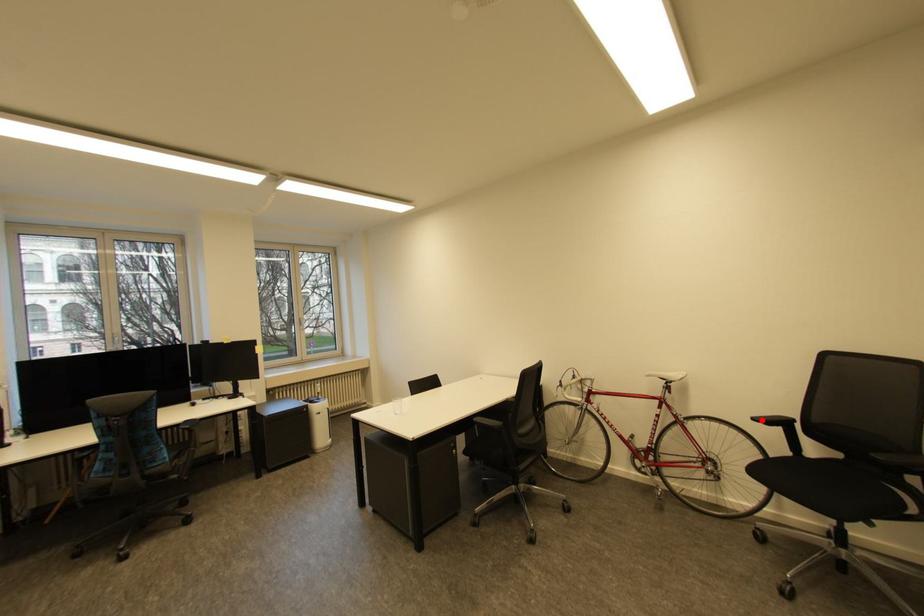
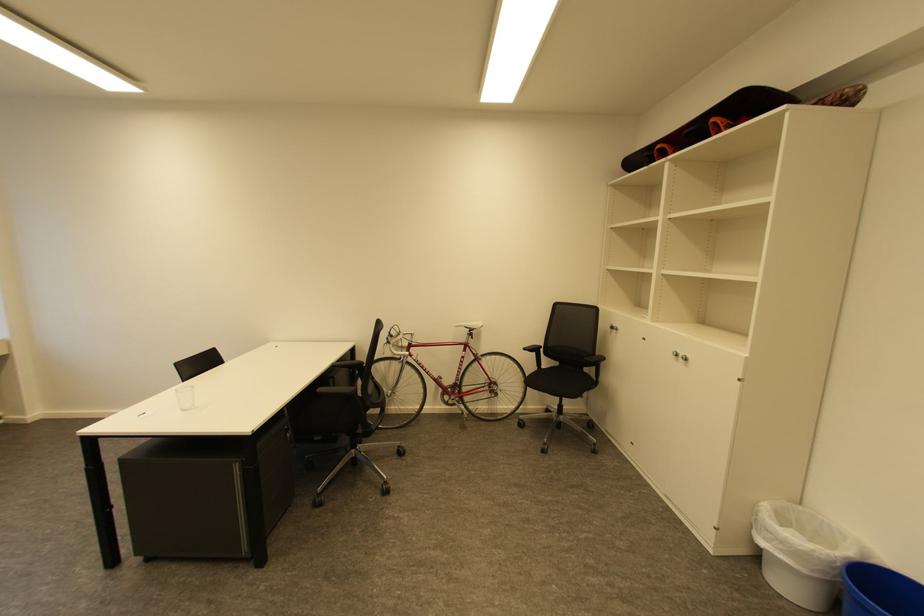
Locate, in the second image, the point that corresponds to the highlighted location in the first image.

(531, 350)